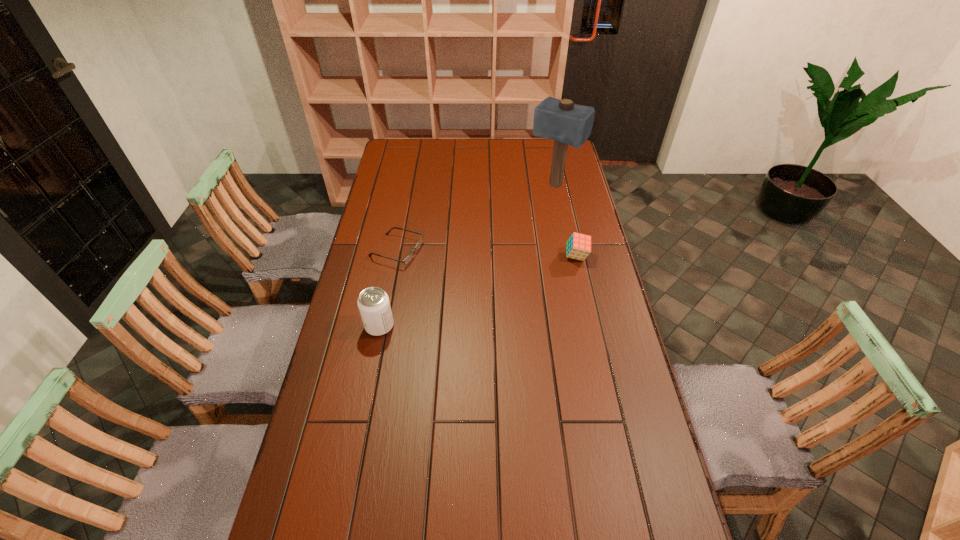
You are a GUI agent. You are given a task and a screenshot of the screen. Output one action in this format:
    pyautogui.click(x=<x>, y=<y>)
    Task: Click on the vacant area at the left edge of the desktop
    This screenshot has width=960, height=540.
    Given the screenshot: What is the action you would take?
    click(357, 294)

The height and width of the screenshot is (540, 960). In order to click on vacant space at the right edge in this screenshot , I will do `click(562, 197)`.

Identify the location of empty space between the soda can and the spectacles. This screenshot has height=540, width=960. (388, 288).

Where is `free space between the soda can and the cube`? The height and width of the screenshot is (540, 960). free space between the soda can and the cube is located at coordinates (478, 291).

Identify the location of vacant area that lies between the third tallest object and the tallest object. The height and width of the screenshot is (540, 960). (565, 221).

This screenshot has width=960, height=540. What are the coordinates of `vacant space that is in between the spectacles and the soda can` in the screenshot? It's located at (388, 288).

Locate an element on the screen. The image size is (960, 540). empty space that is in between the shortest object and the mallet is located at coordinates (475, 218).

I want to click on free spot between the nearest object and the second shortest object, so click(478, 291).

You are a GUI agent. You are given a task and a screenshot of the screen. Output one action in this format:
    pyautogui.click(x=<x>, y=<y>)
    Task: Click on the free space between the tallest object and the cube
    
    Given the screenshot: What is the action you would take?
    pyautogui.click(x=565, y=221)

I want to click on vacant region between the shortest object and the second shortest object, so click(x=487, y=254).